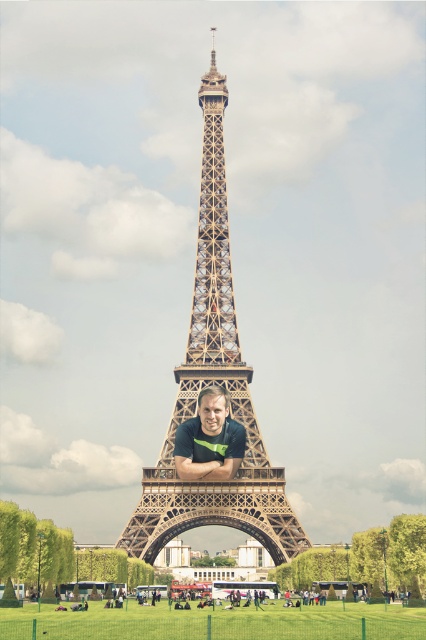
Who is positioned more to the left, brown metal eiffel tower at center or matte black shirt at center?

Positioned to the left is matte black shirt at center.

Between brown metal eiffel tower at center and matte black shirt at center, which one has more height?

brown metal eiffel tower at center is taller.

Between point (138, 509) and point (183, 440), which one is positioned behind?

The point (183, 440) is more distant.

Where is `brown metal eiffel tower at center`? Image resolution: width=426 pixels, height=640 pixels. brown metal eiffel tower at center is located at coordinates (213, 384).